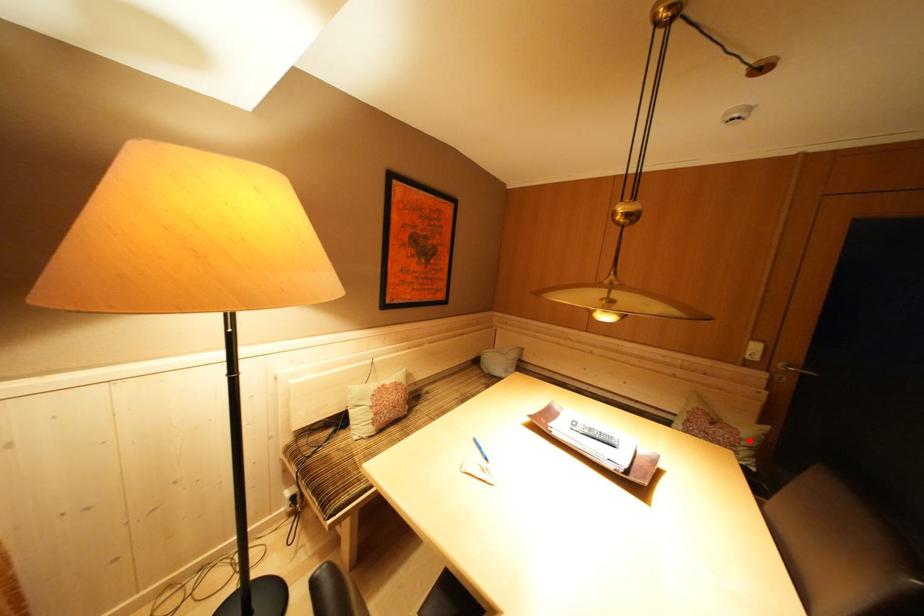
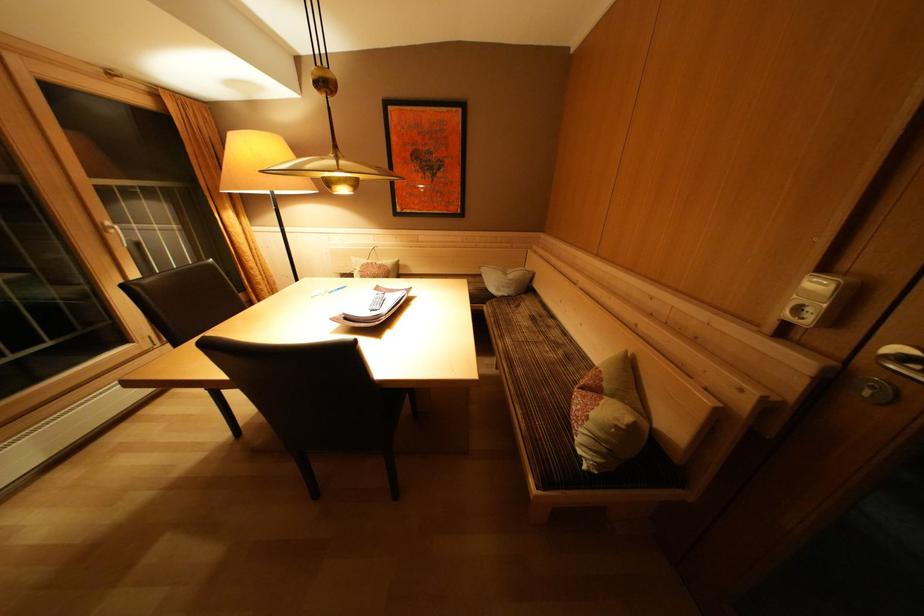
The point at the highlighted location is marked in the first image. Where is the corresponding point in the second image?

(600, 419)